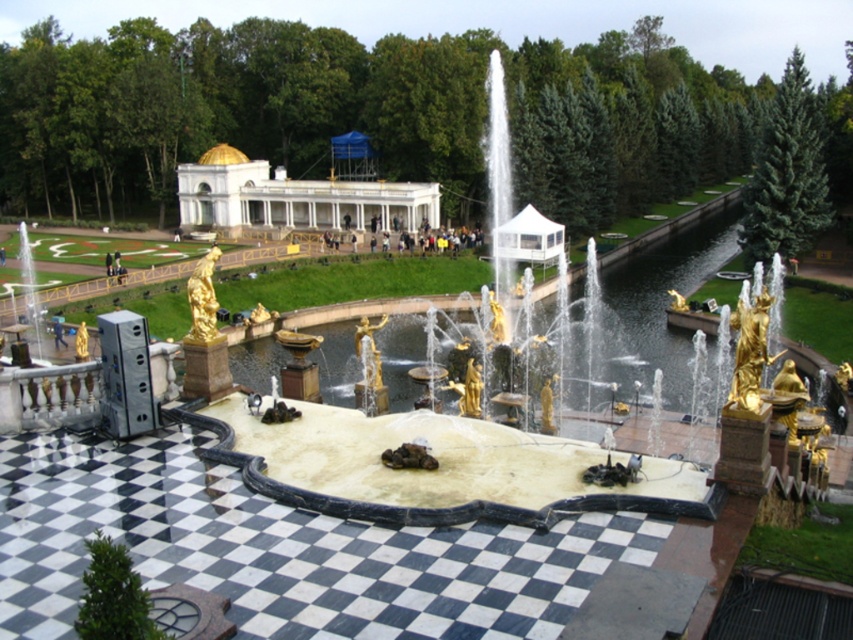
Consider the image. You are standing at the center of the checkerboard walkway surrounding the gold statue fountain at center. If you walk straight ahead, will you walk towards the north or south direction?

The gold statue fountain at center is located at point (456, 468) in 2D coordinates. Since you are at the center of the walkway, which is likely positioned around the fountain, walking straight ahead would depend on your orientation. However, without additional directional information, it is impossible to determine the exact direction you would be facing. Therefore, the direction cannot be definitively answered with the given information.